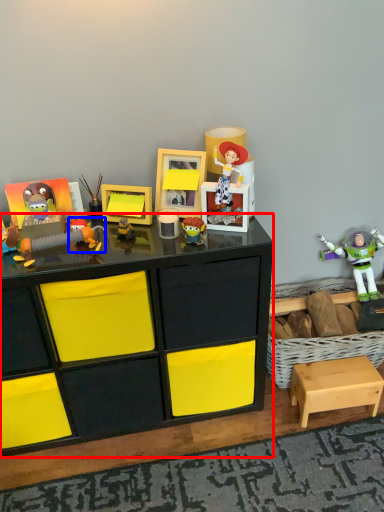
Question: Which point is further to the camera, desk (highlighted by a red box) or toy (highlighted by a blue box)?

Choices:
 (A) desk
 (B) toy

Answer: (B)